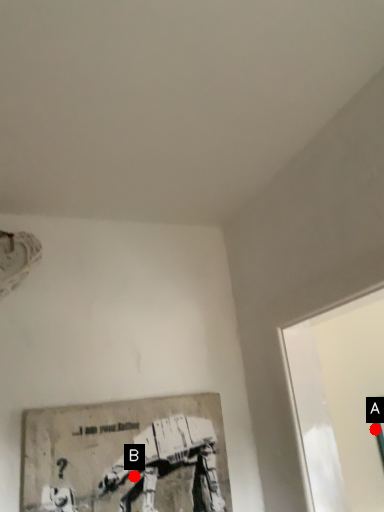
Question: Two points are circled on the image, labeled by A and B beside each circle. Which point is farther from the camera taking this photo?

Choices:
 (A) A is further
 (B) B is further

Answer: (A)